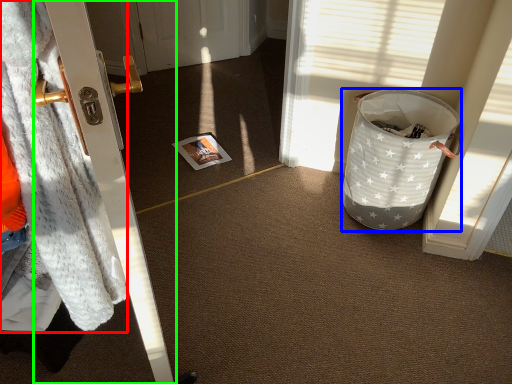
Question: Which is nearer to the blanket (highlighted by a red box)? trash bin/can (highlighted by a blue box) or door (highlighted by a green box).

Choices:
 (A) trash bin/can
 (B) door

Answer: (B)